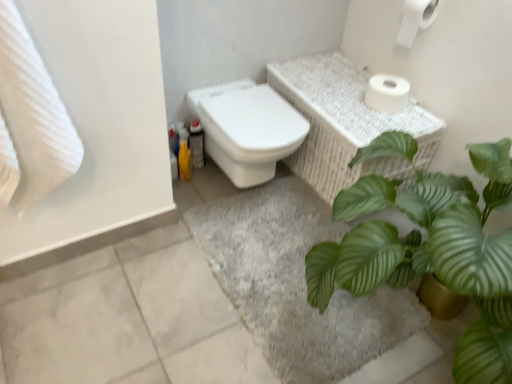
Identify the location of green leafy plant at center. The image size is (512, 384). (429, 247).

What do you see at coordinates (416, 19) in the screenshot?
I see `white matte toilet paper at upper right, which is the 1th toilet paper from top to bottom` at bounding box center [416, 19].

This screenshot has width=512, height=384. Describe the element at coordinates (247, 129) in the screenshot. I see `white glossy toilet at center` at that location.

Find the location of a particular element. The width and height of the screenshot is (512, 384). white textured towel at left is located at coordinates (33, 116).

From the white wicker basket at upper right, count 1st toilet papers backward and point to it. Please provide its 2D coordinates.

[(416, 19)]

Considering the positions of point (356, 100) and point (412, 13), is point (356, 100) closer or farther from the camera than point (412, 13)?

Point (356, 100) is farther from the camera than point (412, 13).

Which object is further away from the camera taking this photo, white wicker basket at upper right or white matte toilet paper at upper right, which is the 1th toilet paper from top to bottom?

white matte toilet paper at upper right, which is the 1th toilet paper from top to bottom, is more distant.

How distant is white matte toilet paper at upper right, which is the 1th toilet paper from top to bottom, from white textured towel at left?

The distance of white matte toilet paper at upper right, which is the 1th toilet paper from top to bottom, from white textured towel at left is 1.51 meters.

How different are the orientations of white matte toilet paper at upper right, which is the 1th toilet paper from top to bottom, and white textured towel at left in degrees?

white matte toilet paper at upper right, which is the 1th toilet paper from top to bottom, and white textured towel at left are facing 90.9 degrees away from each other.

Considering the relative sizes of white matte toilet paper at upper right, which is the 1th toilet paper from top to bottom, and white textured towel at left in the image provided, is white matte toilet paper at upper right, which is the 1th toilet paper from top to bottom, shorter than white textured towel at left?

Indeed, white matte toilet paper at upper right, which is the 1th toilet paper from top to bottom, has a lesser height compared to white textured towel at left.

From a real-world perspective, does white matte toilet paper at upper right, the second toilet paper ordered from the bottom, stand above white textured towel at left?

Indeed, from a real-world perspective, white matte toilet paper at upper right, the second toilet paper ordered from the bottom, stands above white textured towel at left.

Which of these two, white matte toilet paper at upper right, the second toilet paper ordered from the bottom, or white wicker basket at upper right, is smaller?

With smaller size is white matte toilet paper at upper right, the second toilet paper ordered from the bottom.

Between point (411, 3) and point (312, 173), which one is positioned in front?

The point (411, 3) is closer to the camera.

Looking at this image, considering the relative positions of white matte toilet paper at upper right, the second toilet paper ordered from the bottom, and white wicker basket at upper right in the image provided, is white matte toilet paper at upper right, the second toilet paper ordered from the bottom, in front of white wicker basket at upper right?

No, it is behind white wicker basket at upper right.

Could white textured towel at left be considered to be inside white matte toilet paper at upper right, the 2th toilet paper when ordered from top to bottom?

No.

Where is `the 2nd toilet paper behind the white textured towel at left`? the 2nd toilet paper behind the white textured towel at left is located at coordinates (387, 93).

Could you tell me if white matte toilet paper at upper right, which is counted as the 1th toilet paper, starting from the bottom, is turned towards white textured towel at left?

→ Yes, white matte toilet paper at upper right, which is counted as the 1th toilet paper, starting from the bottom, is oriented towards white textured towel at left.

Is white matte toilet paper at upper right, which is counted as the 1th toilet paper, starting from the bottom, positioned far away from white textured towel at left?

Absolutely, white matte toilet paper at upper right, which is counted as the 1th toilet paper, starting from the bottom, is distant from white textured towel at left.

Find the location of a particular element. bath towel in front of the white wicker basket at upper right is located at coordinates (33, 116).

How many degrees apart are the facing directions of white textured towel at left and white wicker basket at upper right?

There is a 90.9-degree angle between the facing directions of white textured towel at left and white wicker basket at upper right.

Is white wicker basket at upper right at the back of white textured towel at left?

white textured towel at left is not turned away from white wicker basket at upper right.

Is green leafy plant at center not within white matte toilet paper at upper right, which is the 1th toilet paper from top to bottom?

A: Yes.

Find the location of a particular element. houseplant in front of the white matte toilet paper at upper right, which is the 1th toilet paper from top to bottom is located at coordinates (429, 247).

Is green leafy plant at center facing towards white matte toilet paper at upper right, which is the 1th toilet paper from top to bottom?

No, green leafy plant at center is not turned towards white matte toilet paper at upper right, which is the 1th toilet paper from top to bottom.

Does point (376, 151) lie in front of point (405, 33)?

Yes.

From the image's perspective, is white wicker basket at upper right positioned above or below green leafy plant at center?

white wicker basket at upper right is above green leafy plant at center.

Find the location of a particular element. The height and width of the screenshot is (384, 512). houseplant on the right of the white wicker basket at upper right is located at coordinates (429, 247).

Does white wicker basket at upper right have a smaller size compared to green leafy plant at center?

Indeed, white wicker basket at upper right has a smaller size compared to green leafy plant at center.

Considering the relative positions of white wicker basket at upper right and green leafy plant at center in the image provided, is white wicker basket at upper right behind green leafy plant at center?

That is True.

Locate an element on the screen. This screenshot has width=512, height=384. balustrade in front of the white matte toilet paper at upper right, which is the 1th toilet paper from top to bottom is located at coordinates (345, 123).

The image size is (512, 384). I want to click on bath towel below the white matte toilet paper at upper right, which is the 1th toilet paper from top to bottom (from the image's perspective), so click(33, 116).

From the image, which object appears to be farther from white wicker basket at upper right, white matte toilet paper at upper right, which is counted as the 1th toilet paper, starting from the bottom, or white matte toilet paper at upper right, the second toilet paper ordered from the bottom?

white matte toilet paper at upper right, the second toilet paper ordered from the bottom.

Considering their positions, is white matte toilet paper at upper right, which is the 1th toilet paper from top to bottom, positioned further to white matte toilet paper at upper right, the 2th toilet paper when ordered from top to bottom, than white glossy toilet at center?

The object further to white matte toilet paper at upper right, the 2th toilet paper when ordered from top to bottom, is white glossy toilet at center.

Which object lies nearer to the anchor point white textured towel at left, white matte toilet paper at upper right, the second toilet paper ordered from the bottom, or gray soft rug at lower center?

gray soft rug at lower center is closer to white textured towel at left.

Considering their positions, is white textured towel at left positioned further to white matte toilet paper at upper right, which is the 1th toilet paper from top to bottom, than white matte toilet paper at upper right, which is counted as the 1th toilet paper, starting from the bottom?

The object further to white matte toilet paper at upper right, which is the 1th toilet paper from top to bottom, is white textured towel at left.

Estimate the real-world distances between objects in this image. Which object is further from white matte toilet paper at upper right, the second toilet paper ordered from the bottom, white textured towel at left or green leafy plant at center?

white textured towel at left.

When comparing their distances from white glossy toilet at center, does white matte toilet paper at upper right, the second toilet paper ordered from the bottom, or white matte toilet paper at upper right, the 2th toilet paper when ordered from top to bottom, seem further?

white matte toilet paper at upper right, the second toilet paper ordered from the bottom, is positioned further to the anchor white glossy toilet at center.

Looking at the image, which one is located closer to white wicker basket at upper right, white textured towel at left or green leafy plant at center?

green leafy plant at center.

Which object lies nearer to the anchor point green leafy plant at center, white matte toilet paper at upper right, which is counted as the 1th toilet paper, starting from the bottom, or white glossy toilet at center?

white glossy toilet at center is closer to green leafy plant at center.

The height and width of the screenshot is (384, 512). I want to click on balustrade between white textured towel at left and white matte toilet paper at upper right, which is counted as the 1th toilet paper, starting from the bottom, so click(x=345, y=123).

Identify the location of toilet between white textured towel at left and white wicker basket at upper right. 247,129.

Locate an element on the screen. This screenshot has width=512, height=384. toilet between white textured towel at left and green leafy plant at center in the horizontal direction is located at coordinates (247, 129).

This screenshot has width=512, height=384. In order to click on bath mat between white textured towel at left and white matte toilet paper at upper right, the 2th toilet paper when ordered from top to bottom in this screenshot , I will do `click(296, 283)`.